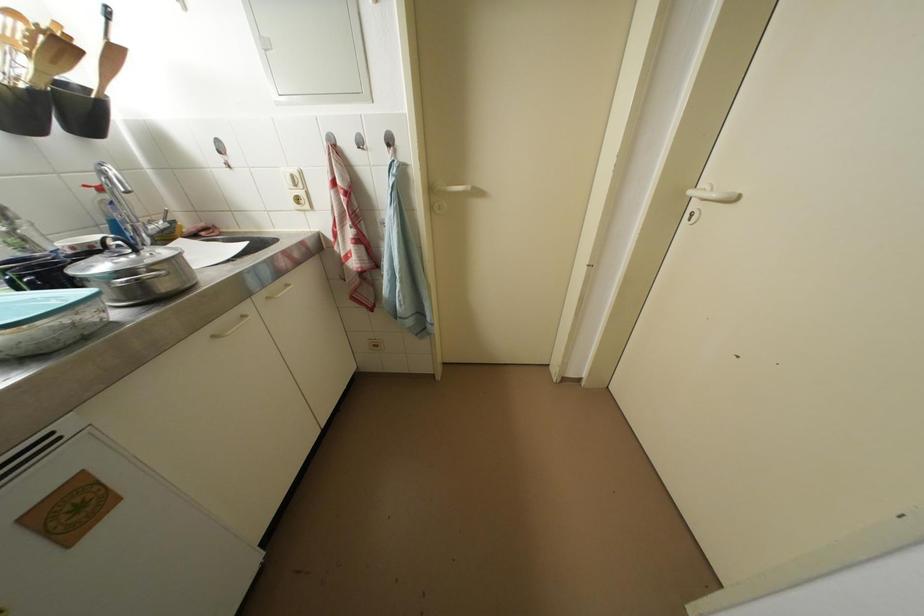
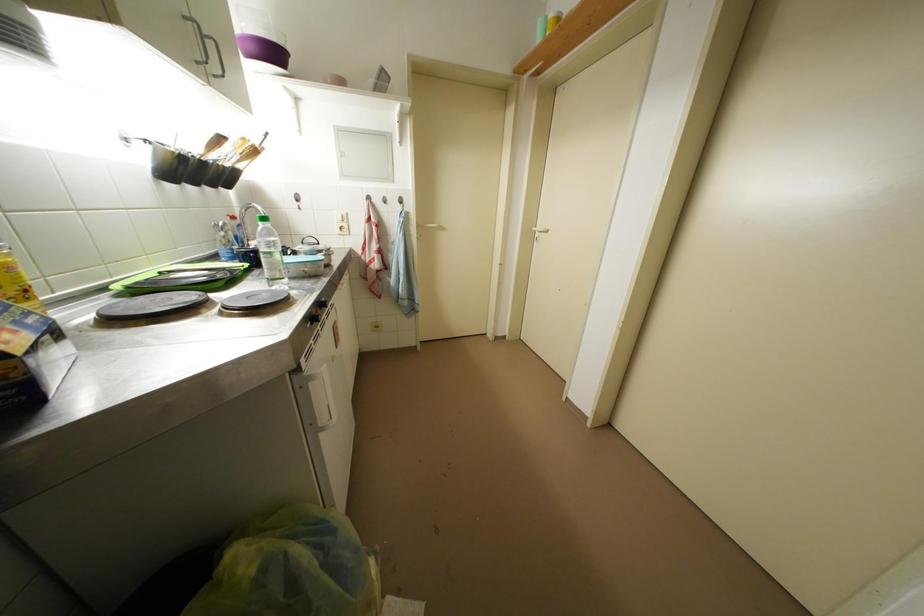
Question: The camera is either moving clockwise (left) or counter-clockwise (right) around the object. The first image is from the beginning of the video and the second image is from the end. Is the camera moving left or right when shooting the video?

Choices:
 (A) Left
 (B) Right

Answer: (A)